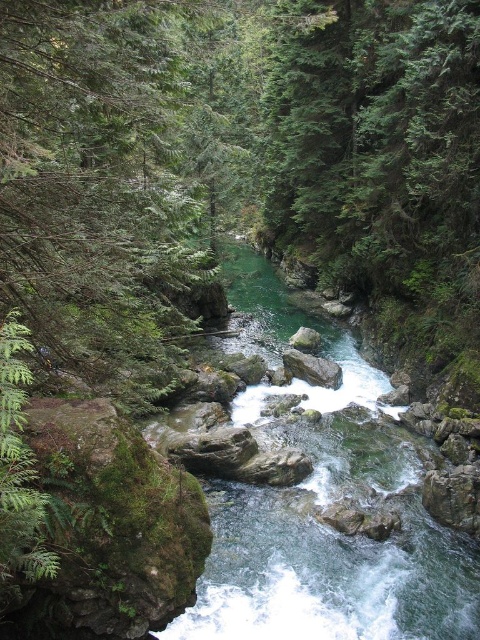
Question: Where is green smooth water at center located in relation to gray rock at center in the image?

Choices:
 (A) above
 (B) below

Answer: (B)

Question: Which object appears closest to the camera in this image?

Choices:
 (A) green smooth water at center
 (B) gray rock at center

Answer: (A)

Question: Does green smooth water at center appear on the right side of gray rock at center?

Choices:
 (A) yes
 (B) no

Answer: (B)

Question: Does green smooth water at center appear on the left side of gray rock at center?

Choices:
 (A) no
 (B) yes

Answer: (B)